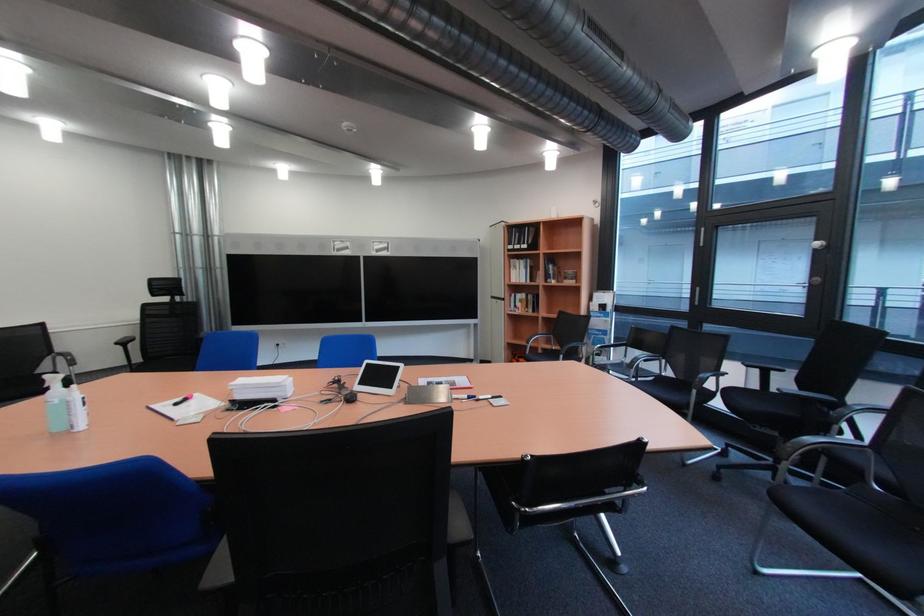
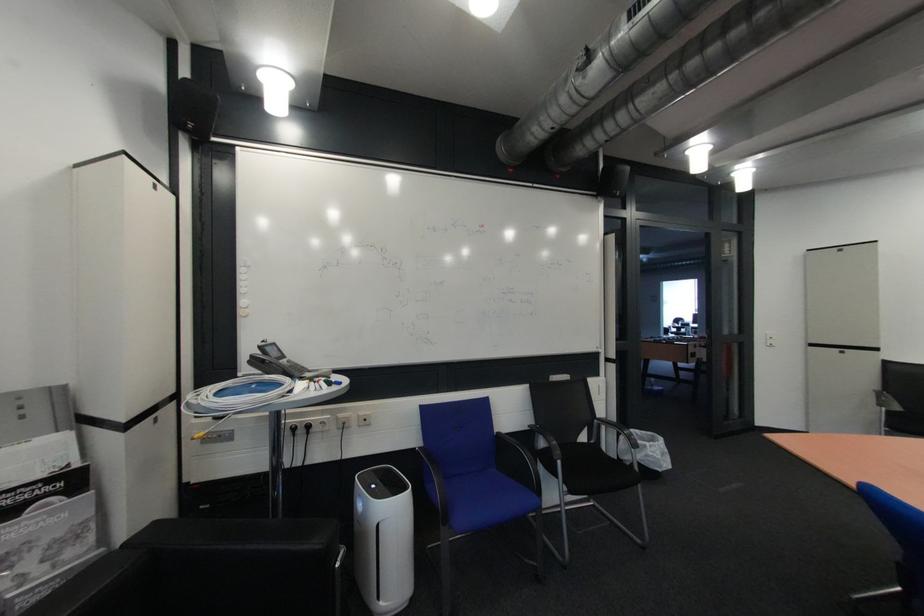
Question: The camera is either moving clockwise (left) or counter-clockwise (right) around the object. The first image is from the beginning of the video and the second image is from the end. Is the camera moving left or right when shooting the video?

Choices:
 (A) Left
 (B) Right

Answer: (B)